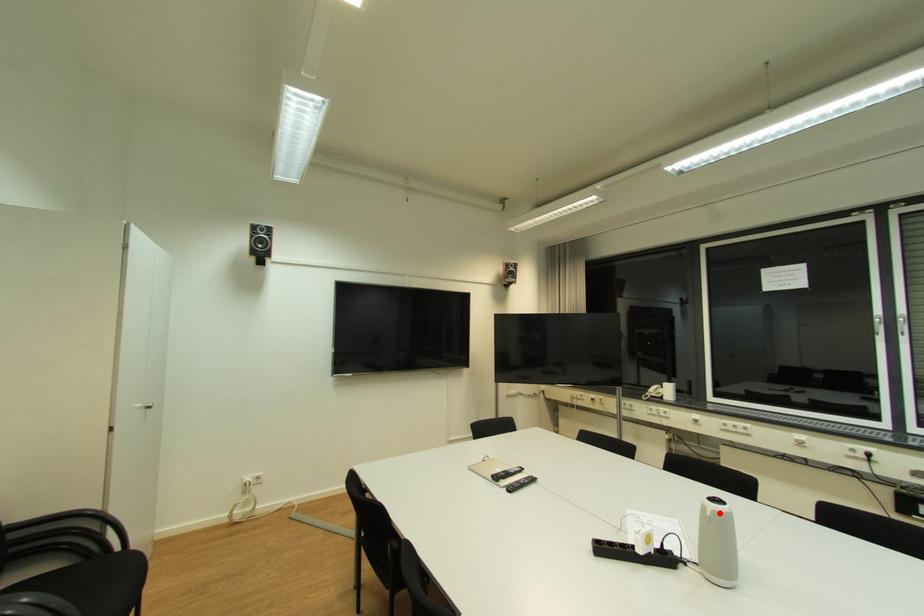
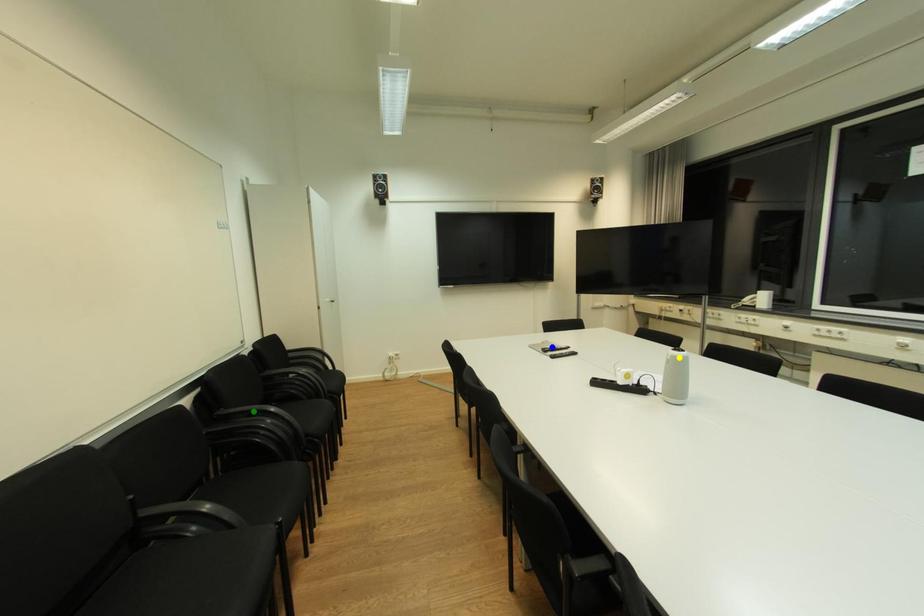
Question: I am providing you with two images of the same scene from different viewpoints. A red point is marked on the first image. You are given multiple points on the second image. Can you choose the point in image 2 that corresponds to the point in image 1?

Choices:
 (A) green point
 (B) blue point
 (C) yellow point

Answer: (C)